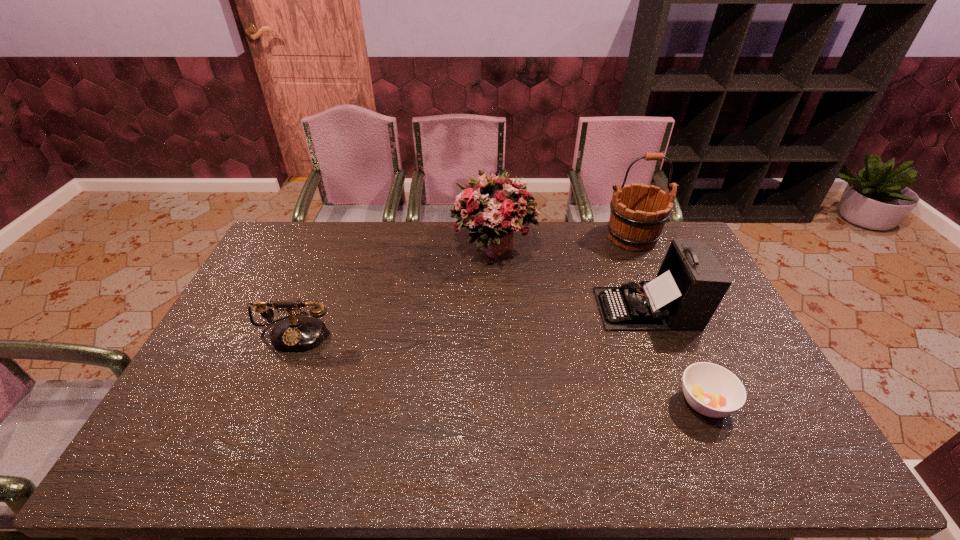
Identify the location of vacant space situated inside the open case of the typewriter. (536, 308).

Where is `free space located inside the open case of the typewriter`? The image size is (960, 540). free space located inside the open case of the typewriter is located at coordinates (552, 308).

At what (x,y) coordinates should I click in order to perform the action: click on vacant point located inside the open case of the typewriter. Please return your answer as a coordinate pair (x, y). Looking at the image, I should click on point(542,308).

You are a GUI agent. You are given a task and a screenshot of the screen. Output one action in this format:
    pyautogui.click(x=<x>, y=<y>)
    Task: Click on the free space located 0.220m on the dial of the second shortest object
    
    Given the screenshot: What is the action you would take?
    pyautogui.click(x=259, y=420)

The width and height of the screenshot is (960, 540). I want to click on vacant space located on the right of the soup bowl, so click(760, 402).

In order to click on wine bucket that is positioned at the far edge in this screenshot , I will do `click(638, 214)`.

You are a GUI agent. You are given a task and a screenshot of the screen. Output one action in this format:
    pyautogui.click(x=<x>, y=<y>)
    Task: Click on the bouquet located in the far edge section of the desktop
    This screenshot has height=540, width=960.
    Given the screenshot: What is the action you would take?
    pyautogui.click(x=494, y=208)

Locate an element on the screen. The width and height of the screenshot is (960, 540). object that is positioned at the left edge is located at coordinates (295, 333).

Where is `wine bucket that is at the right edge`? The width and height of the screenshot is (960, 540). wine bucket that is at the right edge is located at coordinates (638, 214).

Where is `typewriter that is at the right edge`? typewriter that is at the right edge is located at coordinates pyautogui.click(x=690, y=284).